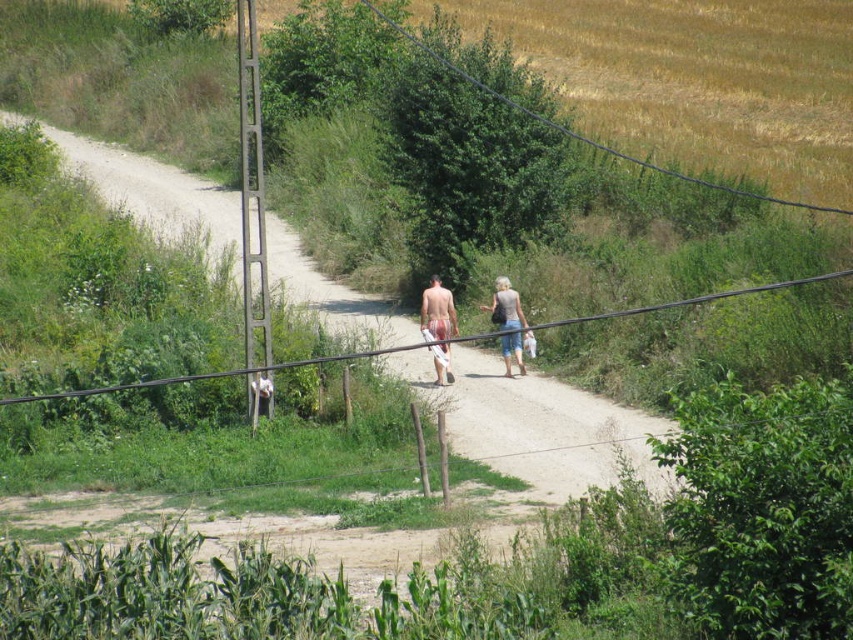
Question: Among these objects, which one is nearest to the camera?

Choices:
 (A) denim shorts at center
 (B) black wire at center

Answer: (B)

Question: Considering the relative positions of matte white shorts at center and white cotton shirt at center in the image provided, where is matte white shorts at center located with respect to white cotton shirt at center?

Choices:
 (A) below
 (B) above

Answer: (B)

Question: Does matte white shorts at center come in front of denim shorts at center?

Choices:
 (A) yes
 (B) no

Answer: (A)

Question: Based on their relative distances, which object is nearer to the white towel at center?

Choices:
 (A) black wire at center
 (B) denim shorts at center

Answer: (B)

Question: Is white towel at center bigger than white cotton shirt at center?

Choices:
 (A) yes
 (B) no

Answer: (A)

Question: Among these points, which one is farthest from the camera?

Choices:
 (A) (444, 310)
 (B) (444, 316)
 (C) (821, 276)

Answer: (C)